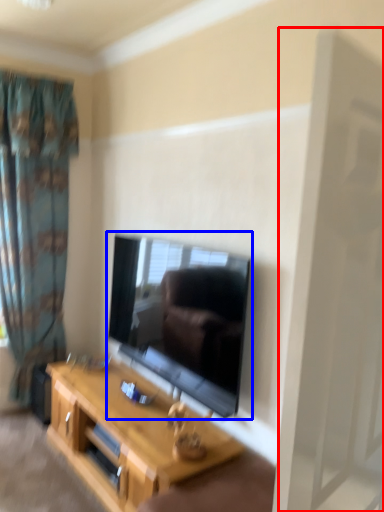
Question: Which of the following is the closest to the observer, screen door (highlighted by a red box) or television (highlighted by a blue box)?

Choices:
 (A) screen door
 (B) television

Answer: (A)